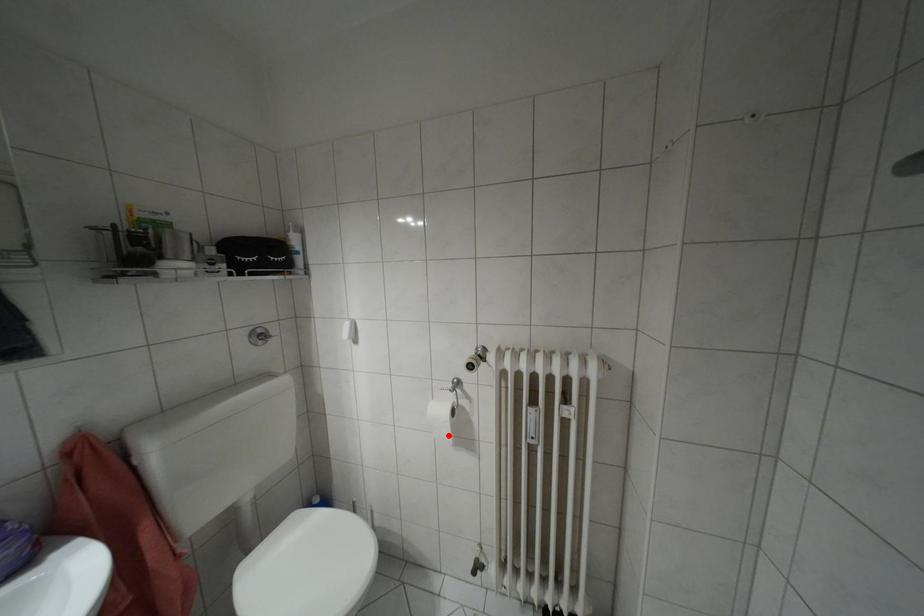
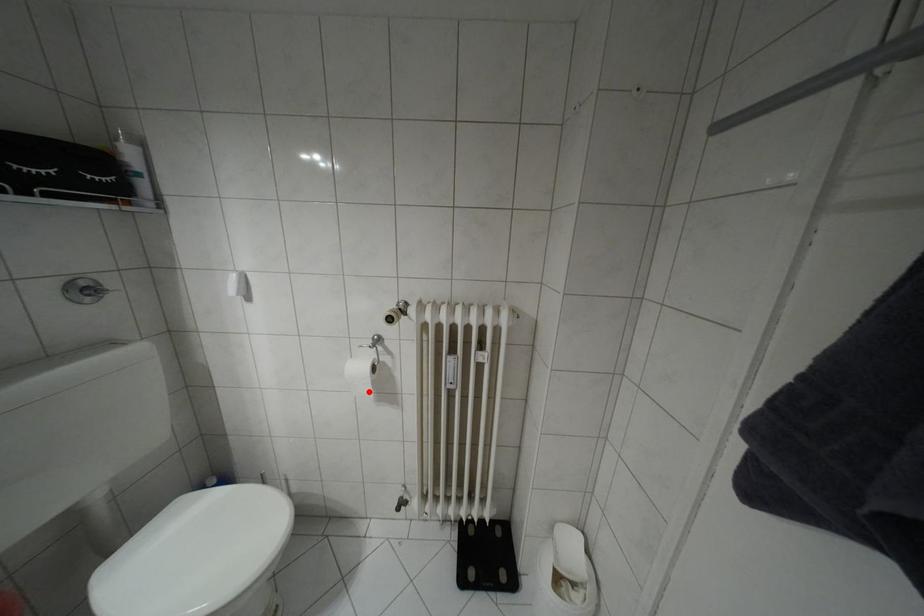
I am providing you with two images of the same scene from different viewpoints. A red point is marked on the first image and another point is marked on the second image. Are the points marked in image1 and image2 representing the same 3D position?

Yes